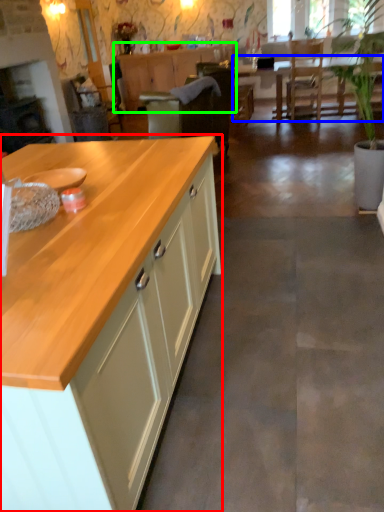
Question: Considering the real-world distances, which object is closest to cabinetry (highlighted by a red box)? table (highlighted by a blue box) or cabinetry (highlighted by a green box).

Choices:
 (A) table
 (B) cabinetry

Answer: (A)